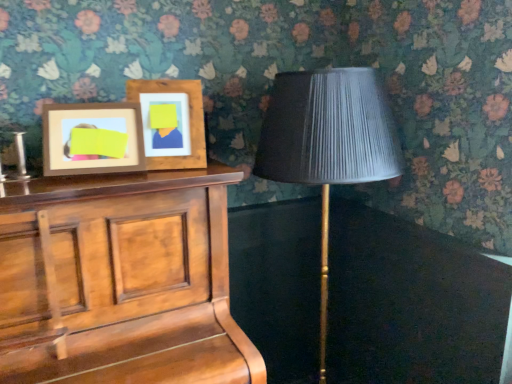
You are a GUI agent. You are given a task and a screenshot of the screen. Output one action in this format:
    pyautogui.click(x=<x>, y=<y>)
    Task: Click on the wooden picture frame at upper left, placed as the 1th picture frame when sorted from right to left
    This screenshot has width=512, height=384.
    Given the screenshot: What is the action you would take?
    pyautogui.click(x=172, y=125)

What do you see at coordinates (172, 125) in the screenshot?
I see `wooden picture frame at upper left, which ranks as the 2th picture frame in left-to-right order` at bounding box center [172, 125].

Locate an element on the screen. The height and width of the screenshot is (384, 512). matte black lampshade at right is located at coordinates (328, 142).

What do you see at coordinates (328, 142) in the screenshot?
I see `matte black lampshade at right` at bounding box center [328, 142].

Locate an element on the screen. Image resolution: width=512 pixels, height=384 pixels. wooden piano at left is located at coordinates (139, 280).

Locate an element on the screen. This screenshot has width=512, height=384. wooden picture frame at upper left, placed as the 1th picture frame when sorted from right to left is located at coordinates (172, 125).

From the image's perspective, which object appears higher, wooden piano at left or wooden picture frame at upper left, acting as the 2th picture frame starting from the right?

wooden picture frame at upper left, acting as the 2th picture frame starting from the right, appears higher in the image.

Consider the image. Considering their positions, is wooden piano at left located in front of or behind wooden picture frame at upper left, acting as the 2th picture frame starting from the right?

In the image, wooden piano at left appears in front of wooden picture frame at upper left, acting as the 2th picture frame starting from the right.

Is wooden piano at left turned away from wooden picture frame at upper left, the first picture frame positioned from the left?

No.

Considering the relative sizes of wooden piano at left and wooden picture frame at upper left, acting as the 2th picture frame starting from the right, in the image provided, is wooden piano at left smaller than wooden picture frame at upper left, acting as the 2th picture frame starting from the right,?

No.

You are a GUI agent. You are given a task and a screenshot of the screen. Output one action in this format:
    pyautogui.click(x=<x>, y=<y>)
    Task: Click on the furniture on the left side of matte black lampshade at right
    This screenshot has height=384, width=512.
    Given the screenshot: What is the action you would take?
    pyautogui.click(x=139, y=280)

Is point (325, 187) closer or farther from the camera than point (130, 250)?

Clearly, point (325, 187) is more distant from the camera than point (130, 250).

Considering the sizes of matte black lampshade at right and wooden piano at left in the image, is matte black lampshade at right taller or shorter than wooden piano at left?

Clearly, matte black lampshade at right is taller compared to wooden piano at left.

Are matte black lampshade at right and wooden piano at left located far from each other?

No, matte black lampshade at right is not far from wooden piano at left.

Considering the positions of points (163, 369) and (262, 162), is point (163, 369) closer to camera compared to point (262, 162)?

Yes, it is in front of point (262, 162).

Consider the image. From the image's perspective, which one is positioned lower, wooden piano at left or matte black lampshade at right?

wooden piano at left appears lower in the image.

At what (x,y) coordinates should I click in order to perform the action: click on furniture that appears below the matte black lampshade at right (from a real-world perspective). Please return your answer as a coordinate pair (x, y). Looking at the image, I should click on (139, 280).

Are wooden piano at left and matte black lampshade at right far apart?

Actually, wooden piano at left and matte black lampshade at right are a little close together.

Locate an element on the screen. the 2nd picture frame positioned above the matte black lampshade at right (from a real-world perspective) is located at coordinates (172, 125).

From their relative heights in the image, would you say wooden picture frame at upper left, which ranks as the 2th picture frame in left-to-right order, is taller or shorter than matte black lampshade at right?

Clearly, wooden picture frame at upper left, which ranks as the 2th picture frame in left-to-right order, is shorter compared to matte black lampshade at right.

Does wooden picture frame at upper left, which ranks as the 2th picture frame in left-to-right order, have a smaller size compared to matte black lampshade at right?

Yes, wooden picture frame at upper left, which ranks as the 2th picture frame in left-to-right order, is smaller than matte black lampshade at right.

In the image, is wooden picture frame at upper left, which ranks as the 2th picture frame in left-to-right order, positioned in front of or behind matte black lampshade at right?

wooden picture frame at upper left, which ranks as the 2th picture frame in left-to-right order, is behind matte black lampshade at right.

Is the depth of wooden picture frame at upper left, which ranks as the 2th picture frame in left-to-right order, less than that of wooden picture frame at upper left, acting as the 2th picture frame starting from the right?

No, the depth of wooden picture frame at upper left, which ranks as the 2th picture frame in left-to-right order, is greater than that of wooden picture frame at upper left, acting as the 2th picture frame starting from the right.

Looking at this image, in terms of width, does wooden picture frame at upper left, placed as the 1th picture frame when sorted from right to left, look wider or thinner when compared to wooden picture frame at upper left, acting as the 2th picture frame starting from the right?

Considering their sizes, wooden picture frame at upper left, placed as the 1th picture frame when sorted from right to left, looks broader than wooden picture frame at upper left, acting as the 2th picture frame starting from the right.

Is wooden picture frame at upper left, placed as the 1th picture frame when sorted from right to left, taller or shorter than wooden picture frame at upper left, acting as the 2th picture frame starting from the right?

Considering their sizes, wooden picture frame at upper left, placed as the 1th picture frame when sorted from right to left, has more height than wooden picture frame at upper left, acting as the 2th picture frame starting from the right.

From the image's perspective, who appears lower, wooden picture frame at upper left, which ranks as the 2th picture frame in left-to-right order, or wooden picture frame at upper left, the first picture frame positioned from the left?

wooden picture frame at upper left, the first picture frame positioned from the left, is shown below in the image.

What are the coordinates of `the 1st picture frame above the wooden piano at left (from the image's perspective)` in the screenshot? It's located at (92, 139).

Is point (103, 103) closer or farther from the camera than point (190, 183)?

Point (103, 103) appears to be farther away from the viewer than point (190, 183).

Is wooden picture frame at upper left, acting as the 2th picture frame starting from the right, not close to wooden piano at left?

No, wooden picture frame at upper left, acting as the 2th picture frame starting from the right, is not far from wooden piano at left.

Measure the distance between wooden picture frame at upper left, the first picture frame positioned from the left, and wooden piano at left.

wooden picture frame at upper left, the first picture frame positioned from the left, is 10.58 inches away from wooden piano at left.

At what (x,y) coordinates should I click in order to perform the action: click on picture frame that appears below the wooden picture frame at upper left, placed as the 1th picture frame when sorted from right to left (from the image's perspective). Please return your answer as a coordinate pair (x, y). The image size is (512, 384). Looking at the image, I should click on point(92,139).

Is wooden picture frame at upper left, the first picture frame positioned from the left, to the right of wooden picture frame at upper left, which ranks as the 2th picture frame in left-to-right order, from the viewer's perspective?

Incorrect, wooden picture frame at upper left, the first picture frame positioned from the left, is not on the right side of wooden picture frame at upper left, which ranks as the 2th picture frame in left-to-right order.

Is wooden picture frame at upper left, the first picture frame positioned from the left, positioned with its back to wooden picture frame at upper left, placed as the 1th picture frame when sorted from right to left?

wooden picture frame at upper left, the first picture frame positioned from the left, does not have its back to wooden picture frame at upper left, placed as the 1th picture frame when sorted from right to left.

From a real-world perspective, is wooden picture frame at upper left, the first picture frame positioned from the left, positioned under wooden picture frame at upper left, which ranks as the 2th picture frame in left-to-right order, based on gravity?

Yes, from a real-world perspective, wooden picture frame at upper left, the first picture frame positioned from the left, is below wooden picture frame at upper left, which ranks as the 2th picture frame in left-to-right order.

Locate an element on the screen. This screenshot has height=384, width=512. furniture on the right of wooden picture frame at upper left, the first picture frame positioned from the left is located at coordinates (139, 280).

Identify the location of table lamp positioned vertically above the wooden piano at left (from a real-world perspective). (328, 142).

Which object lies nearer to the anchor point wooden picture frame at upper left, the first picture frame positioned from the left, matte black lampshade at right or wooden picture frame at upper left, placed as the 1th picture frame when sorted from right to left?

The object closer to wooden picture frame at upper left, the first picture frame positioned from the left, is wooden picture frame at upper left, placed as the 1th picture frame when sorted from right to left.

Based on their spatial positions, is wooden picture frame at upper left, the first picture frame positioned from the left, or matte black lampshade at right further from wooden piano at left?

matte black lampshade at right is further to wooden piano at left.

In the scene shown: From the image, which object appears to be farther from wooden picture frame at upper left, placed as the 1th picture frame when sorted from right to left, wooden piano at left or wooden picture frame at upper left, acting as the 2th picture frame starting from the right?

wooden piano at left lies further to wooden picture frame at upper left, placed as the 1th picture frame when sorted from right to left, than the other object.

Which object lies further to the anchor point wooden piano at left, wooden picture frame at upper left, placed as the 1th picture frame when sorted from right to left, or matte black lampshade at right?

The object further to wooden piano at left is matte black lampshade at right.

Based on their spatial positions, is wooden piano at left or wooden picture frame at upper left, acting as the 2th picture frame starting from the right, closer to matte black lampshade at right?

wooden piano at left is positioned closer to the anchor matte black lampshade at right.

Looking at the image, which one is located closer to wooden piano at left, matte black lampshade at right or wooden picture frame at upper left, which ranks as the 2th picture frame in left-to-right order?

wooden picture frame at upper left, which ranks as the 2th picture frame in left-to-right order, is positioned closer to the anchor wooden piano at left.

Considering their positions, is wooden piano at left positioned closer to wooden picture frame at upper left, placed as the 1th picture frame when sorted from right to left, than matte black lampshade at right?

wooden piano at left is positioned closer to the anchor wooden picture frame at upper left, placed as the 1th picture frame when sorted from right to left.

Considering their positions, is wooden picture frame at upper left, which ranks as the 2th picture frame in left-to-right order, positioned further to wooden picture frame at upper left, the first picture frame positioned from the left, than matte black lampshade at right?

matte black lampshade at right is further to wooden picture frame at upper left, the first picture frame positioned from the left.

Locate an element on the screen. Image resolution: width=512 pixels, height=384 pixels. furniture located between wooden picture frame at upper left, the first picture frame positioned from the left, and matte black lampshade at right in the left-right direction is located at coordinates (139, 280).

At what (x,y) coordinates should I click in order to perform the action: click on picture frame between wooden picture frame at upper left, placed as the 1th picture frame when sorted from right to left, and wooden piano at left vertically. Please return your answer as a coordinate pair (x, y). Looking at the image, I should click on (92, 139).

I want to click on picture frame situated between wooden picture frame at upper left, acting as the 2th picture frame starting from the right, and matte black lampshade at right from left to right, so click(172, 125).

I want to click on table lamp between wooden picture frame at upper left, which ranks as the 2th picture frame in left-to-right order, and wooden piano at left in the up-down direction, so click(x=328, y=142).